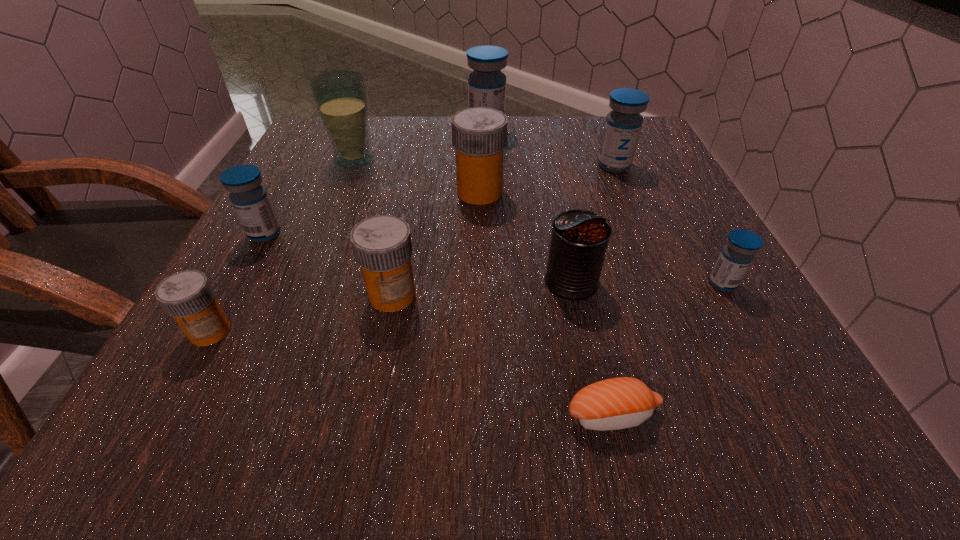
The width and height of the screenshot is (960, 540). In order to click on the second nearest blue medicine in this screenshot , I will do [250, 200].

I want to click on the fourth object from left to right, so click(382, 246).

Where is `the third medicine from left to right`? Image resolution: width=960 pixels, height=540 pixels. the third medicine from left to right is located at coordinates (382, 246).

Identify the location of the rightmost medicine. (737, 255).

Where is `the smallest blue medicine`? This screenshot has height=540, width=960. the smallest blue medicine is located at coordinates (737, 255).

The height and width of the screenshot is (540, 960). Find the location of `the leftmost orange medicine`. the leftmost orange medicine is located at coordinates (187, 296).

Locate an element on the screen. This screenshot has height=540, width=960. the smallest orange medicine is located at coordinates coord(187,296).

Where is `sushi`? sushi is located at coordinates (617, 403).

This screenshot has width=960, height=540. Identify the location of the shortest object. (617, 403).

The image size is (960, 540). I want to click on blank space located 0.140m on the left of the third blue medicine from right to left, so click(x=409, y=132).